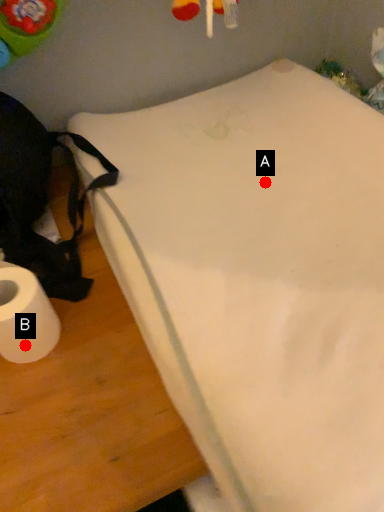
Question: Two points are circled on the image, labeled by A and B beside each circle. Which of the following is the farthest from the observer?

Choices:
 (A) A is further
 (B) B is further

Answer: (A)